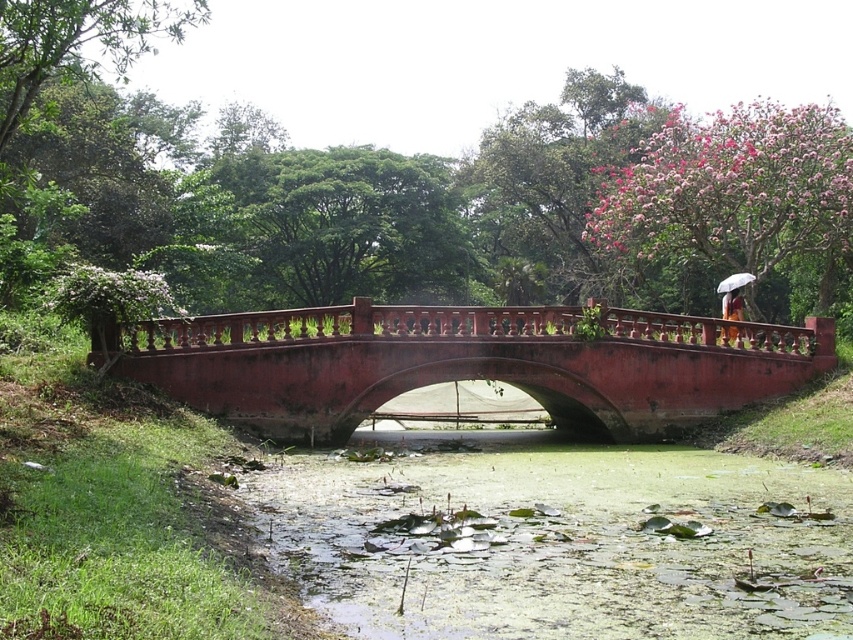
Who is taller, smooth red bridge at center or white matte umbrella at upper right?

smooth red bridge at center is taller.

Can you confirm if smooth red bridge at center is smaller than white matte umbrella at upper right?

Actually, smooth red bridge at center might be larger than white matte umbrella at upper right.

The width and height of the screenshot is (853, 640). What do you see at coordinates (471, 364) in the screenshot? I see `smooth red bridge at center` at bounding box center [471, 364].

The height and width of the screenshot is (640, 853). I want to click on smooth red bridge at center, so click(x=471, y=364).

Can you confirm if green algae-covered water at center is positioned above smooth red bridge at center?

Incorrect, green algae-covered water at center is not positioned above smooth red bridge at center.

Who is more distant from viewer, (753, 461) or (677, 358)?

Positioned behind is point (677, 358).

Where is `green algae-covered water at center`? The width and height of the screenshot is (853, 640). green algae-covered water at center is located at coordinates (561, 544).

Looking at this image, does green algae-covered water at center have a lesser height compared to white matte umbrella at upper right?

Yes, green algae-covered water at center is shorter than white matte umbrella at upper right.

Who is more forward, (370, 548) or (741, 280)?

Positioned in front is point (370, 548).

The image size is (853, 640). Identify the location of green algae-covered water at center. (561, 544).